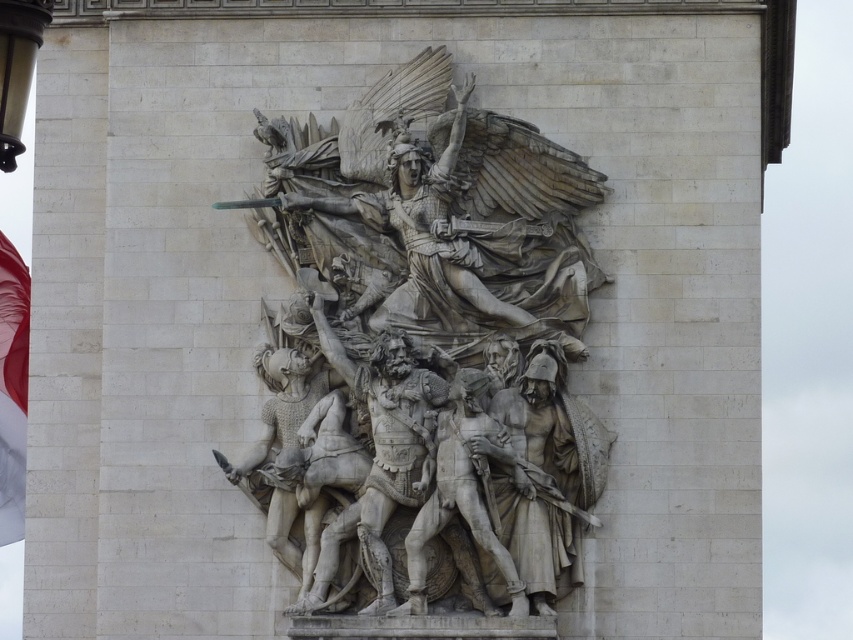
Question: Can you confirm if white stone sculpture at center is positioned below red fabric flag at left?

Choices:
 (A) yes
 (B) no

Answer: (B)

Question: Considering the relative positions of white stone sculpture at center and red fabric flag at left in the image provided, where is white stone sculpture at center located with respect to red fabric flag at left?

Choices:
 (A) below
 (B) above

Answer: (B)

Question: Can you confirm if white stone sculpture at center is positioned to the left of red fabric flag at left?

Choices:
 (A) yes
 (B) no

Answer: (B)

Question: Among these objects, which one is nearest to the camera?

Choices:
 (A) red fabric flag at left
 (B) white stone sculpture at center

Answer: (B)